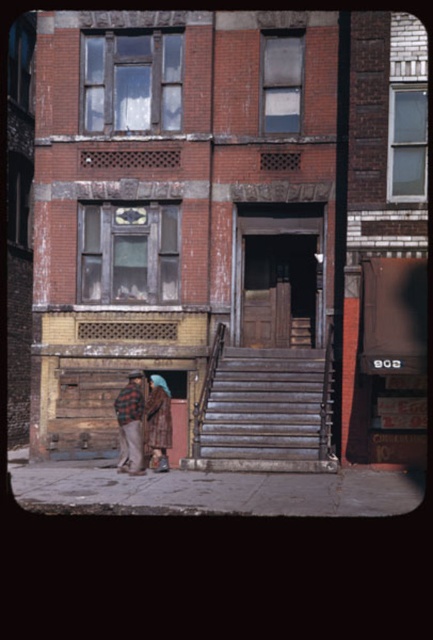
Question: Which point appears farthest from the camera in this image?

Choices:
 (A) (129, 392)
 (B) (160, 396)

Answer: (B)

Question: Which of the following is the farthest from the observer?

Choices:
 (A) rusty metal stairs at center
 (B) brown textured coat at lower left
 (C) plaid flannel shirt at lower left

Answer: (B)

Question: Is rusty metal stairs at center positioned at the back of plaid flannel shirt at lower left?

Choices:
 (A) yes
 (B) no

Answer: (B)

Question: Where is rusty metal stairs at center located in relation to brown textured coat at lower left in the image?

Choices:
 (A) below
 (B) above

Answer: (B)

Question: Does rusty metal stairs at center come in front of plaid flannel shirt at lower left?

Choices:
 (A) no
 (B) yes

Answer: (B)

Question: Which point is farther from the camera taking this photo?

Choices:
 (A) (297, 449)
 (B) (157, 378)
 (C) (126, 465)

Answer: (B)